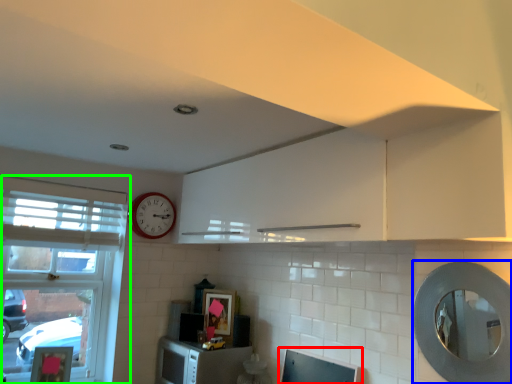
Question: Based on their relative distances, which object is nearer to computer monitor (highlighted by a red box)? Choose from oval (highlighted by a blue box) and window (highlighted by a green box).

Choices:
 (A) oval
 (B) window

Answer: (A)